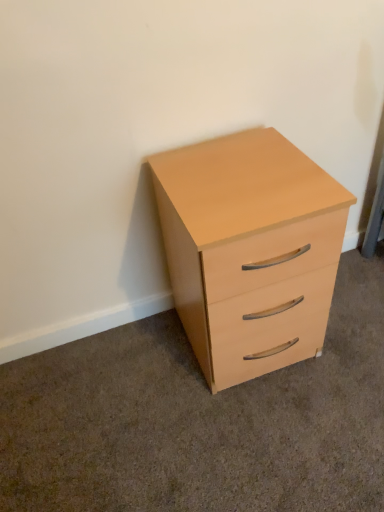
The width and height of the screenshot is (384, 512). What are the coordinates of `vacant space situated on the left part of light wood/finish chest of drawers at center` in the screenshot? It's located at (137, 373).